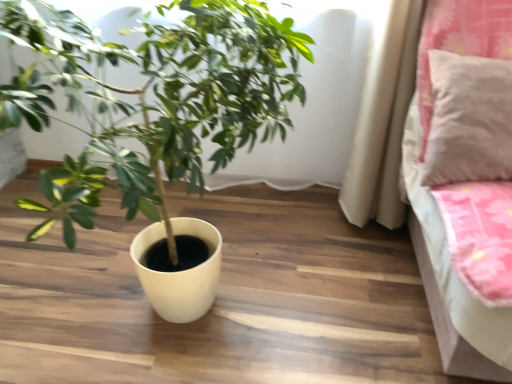
This screenshot has width=512, height=384. What are the coordinates of `matte white pot at center` in the screenshot? It's located at (156, 116).

The width and height of the screenshot is (512, 384). What do you see at coordinates (156, 116) in the screenshot? I see `matte white pot at center` at bounding box center [156, 116].

Identify the location of pink fabric pillow at upper right. This screenshot has height=384, width=512. tap(469, 120).

The height and width of the screenshot is (384, 512). What do you see at coordinates (469, 120) in the screenshot?
I see `pink fabric pillow at upper right` at bounding box center [469, 120].

In order to face pink fabric pillow at upper right, should I rotate leftwards or rightwards?

Turn right approximately 28.405 degrees to face it.

You are a GUI agent. You are given a task and a screenshot of the screen. Output one action in this format:
    pyautogui.click(x=<x>, y=<y>)
    Task: Click on the matte white pot at center
    
    Given the screenshot: What is the action you would take?
    pyautogui.click(x=156, y=116)

Is pink fabric pillow at upper right to the left of matte white pot at center from the viewer's perspective?

In fact, pink fabric pillow at upper right is to the right of matte white pot at center.

Which object is closer to the camera taking this photo, pink fabric pillow at upper right or matte white pot at center?

matte white pot at center is more forward.

Considering the points (452, 56) and (95, 115), which point is in front, point (452, 56) or point (95, 115)?

Point (452, 56)

From the image's perspective, which is below, pink fabric pillow at upper right or matte white pot at center?

matte white pot at center.

From a real-world perspective, between pink fabric pillow at upper right and matte white pot at center, who is vertically lower?

From a 3D spatial view, matte white pot at center is below.

Considering the relative sizes of pink fabric pillow at upper right and matte white pot at center in the image provided, is pink fabric pillow at upper right wider than matte white pot at center?

Incorrect, the width of pink fabric pillow at upper right does not surpass that of matte white pot at center.

Who is taller, pink fabric pillow at upper right or matte white pot at center?

matte white pot at center is taller.

Which of these two, pink fabric pillow at upper right or matte white pot at center, is bigger?

matte white pot at center.

Would you say pink fabric pillow at upper right is outside matte white pot at center?

pink fabric pillow at upper right is positioned outside matte white pot at center.

Are pink fabric pillow at upper right and matte white pot at center beside each other?

pink fabric pillow at upper right and matte white pot at center are clearly separated.

Is matte white pot at center at the back of pink fabric pillow at upper right?

No, pink fabric pillow at upper right's orientation is not away from matte white pot at center.

How many degrees apart are the facing directions of pink fabric pillow at upper right and matte white pot at center?

The angular difference between pink fabric pillow at upper right and matte white pot at center is 1.87e-05 degrees.

Where is `houseplant to the left of pink fabric pillow at upper right`? houseplant to the left of pink fabric pillow at upper right is located at coordinates pos(156,116).

Between matte white pot at center and pink fabric pillow at upper right, which one appears on the right side from the viewer's perspective?

pink fabric pillow at upper right.

Which object is closer to the camera taking this photo, matte white pot at center or pink fabric pillow at upper right?

matte white pot at center is in front.

Is point (181, 140) farther from camera compared to point (445, 169)?

No, (181, 140) is in front of (445, 169).

From the image's perspective, which one is positioned lower, matte white pot at center or pink fabric pillow at upper right?

matte white pot at center is shown below in the image.

From a real-world perspective, which object stands above the other?

From a 3D spatial view, pink fabric pillow at upper right is above.

Does matte white pot at center have a lesser width compared to pink fabric pillow at upper right?

No.

Based on the photo, is matte white pot at center taller than pink fabric pillow at upper right?

Yes, matte white pot at center is taller than pink fabric pillow at upper right.

Considering the sizes of matte white pot at center and pink fabric pillow at upper right in the image, is matte white pot at center bigger or smaller than pink fabric pillow at upper right?

In the image, matte white pot at center appears to be larger than pink fabric pillow at upper right.

Is matte white pot at center not inside pink fabric pillow at upper right?

matte white pot at center lies outside pink fabric pillow at upper right's area.

Is matte white pot at center positioned far away from pink fabric pillow at upper right?

No, matte white pot at center is not far from pink fabric pillow at upper right.

Is matte white pot at center facing away from pink fabric pillow at upper right?

No.

Can you tell me how much matte white pot at center and pink fabric pillow at upper right differ in facing direction?

There is a 1.87e-05-degree angle between the facing directions of matte white pot at center and pink fabric pillow at upper right.

Measure the distance from matte white pot at center to pink fabric pillow at upper right.

matte white pot at center and pink fabric pillow at upper right are 24.14 inches apart from each other.

In order to click on pillow behind the matte white pot at center in this screenshot , I will do `click(469, 120)`.

I want to click on houseplant on the left of pink fabric pillow at upper right, so click(x=156, y=116).

Find the location of a particular element. The width and height of the screenshot is (512, 384). houseplant below the pink fabric pillow at upper right (from the image's perspective) is located at coordinates (156, 116).